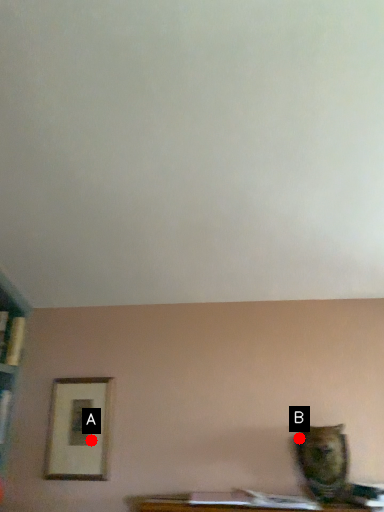
Question: Two points are circled on the image, labeled by A and B beside each circle. Among these points, which one is farthest from the camera?

Choices:
 (A) A is further
 (B) B is further

Answer: (A)